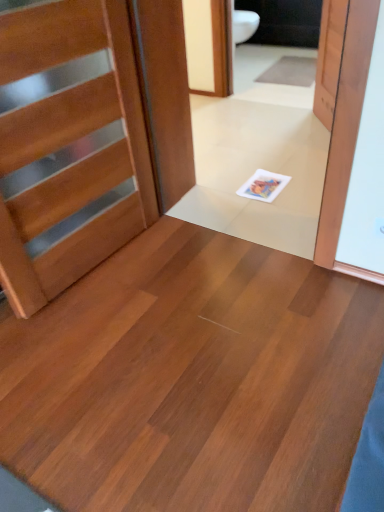
Image resolution: width=384 pixels, height=512 pixels. Find the location of `free space to the left of wooden door at upper right, which is the 1th door in right-to-left order`. free space to the left of wooden door at upper right, which is the 1th door in right-to-left order is located at coordinates (280, 133).